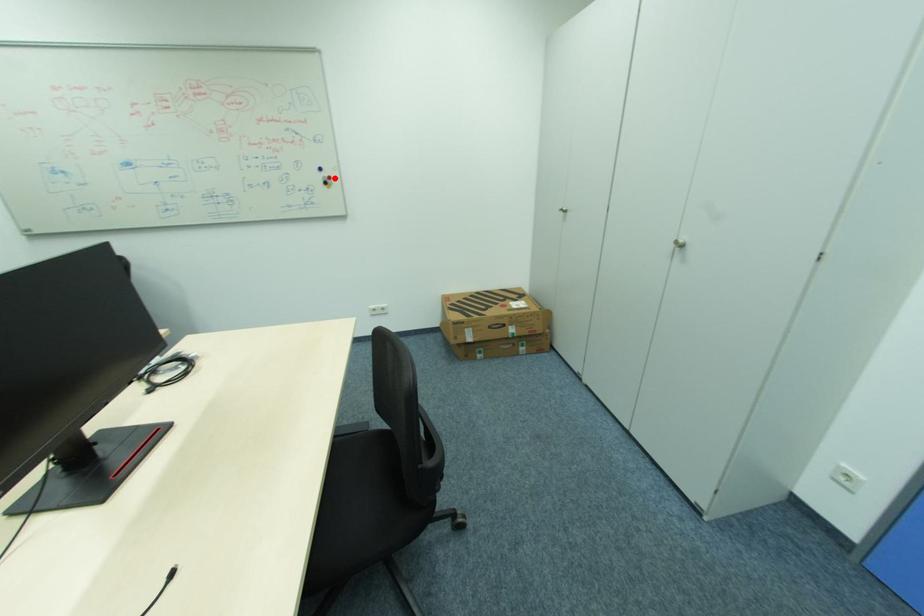
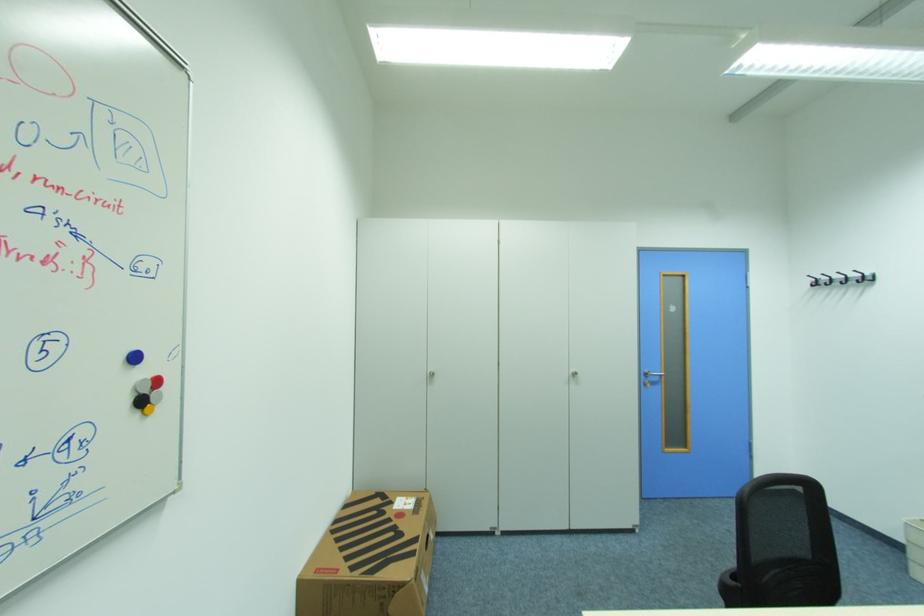
Find the pixel in the second image that matches the highlighted location in the first image.

(162, 382)